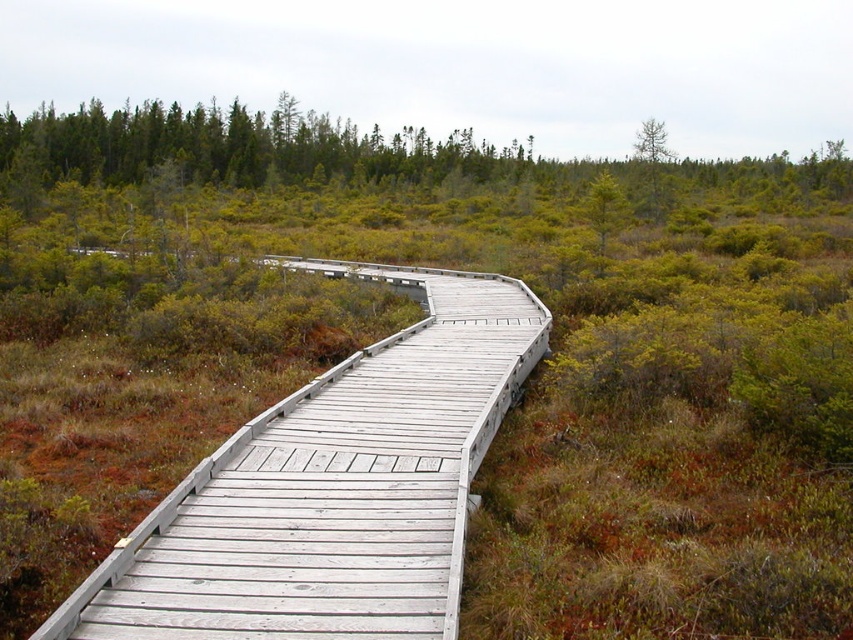
Question: Can you confirm if green matte tree at upper center is wider than green matte tree at upper right?

Choices:
 (A) no
 (B) yes

Answer: (A)

Question: Which is nearer to the light gray wooden bridge at center?

Choices:
 (A) green matte tree at upper right
 (B) green matte tree at upper center

Answer: (B)

Question: Among these points, which one is farthest from the camera?

Choices:
 (A) (592, 216)
 (B) (241, 516)
 (C) (637, 134)

Answer: (C)

Question: Among these objects, which one is farthest from the camera?

Choices:
 (A) green matte tree at upper right
 (B) green matte tree at upper center

Answer: (A)

Question: Is light gray wooden bridge at center further to the viewer compared to green matte tree at upper right?

Choices:
 (A) no
 (B) yes

Answer: (A)

Question: From the image, what is the correct spatial relationship of light gray wooden bridge at center in relation to green matte tree at upper right?

Choices:
 (A) right
 (B) left

Answer: (B)